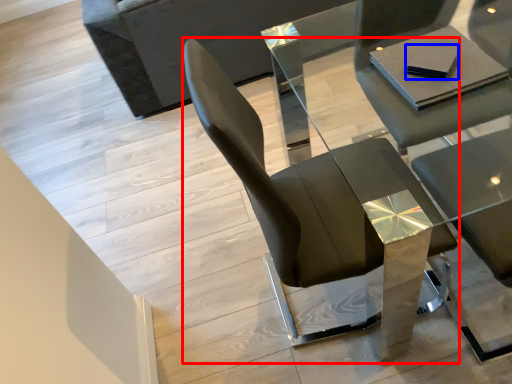
Question: Among these objects, which one is nearest to the camera, chair (highlighted by a red box) or pad (highlighted by a blue box)?

Choices:
 (A) chair
 (B) pad

Answer: (A)